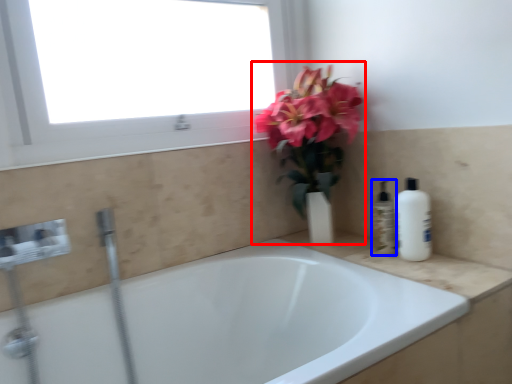
Question: Which point is closer to the camera, floral arrangement (highlighted by a red box) or toiletry (highlighted by a blue box)?

Choices:
 (A) floral arrangement
 (B) toiletry

Answer: (A)